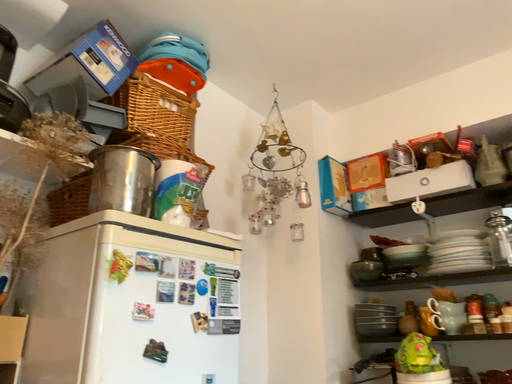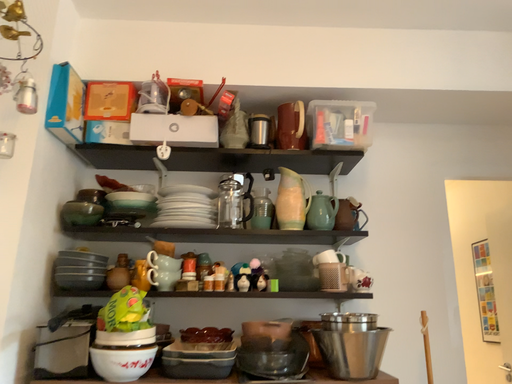
Question: How did the camera likely rotate when shooting the video?

Choices:
 (A) rotated left
 (B) rotated right

Answer: (B)